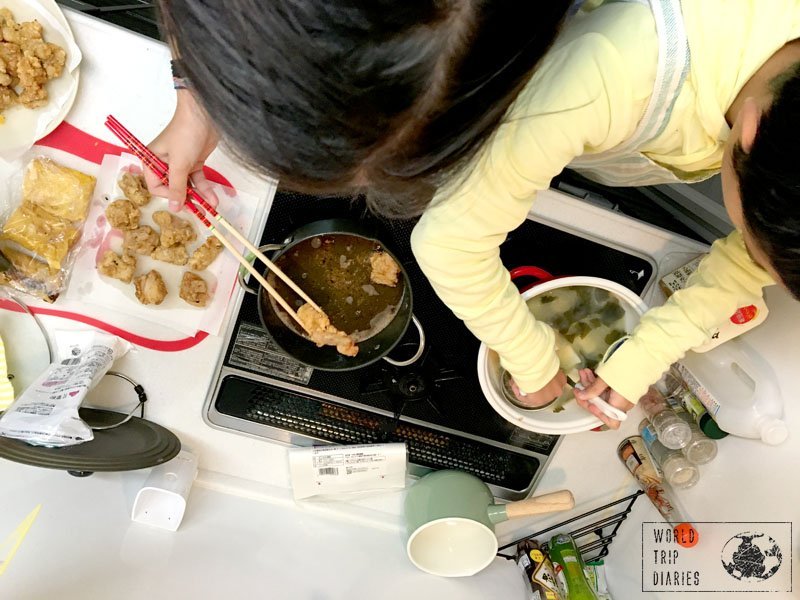
This screenshot has height=600, width=800. In order to click on pots in this screenshot , I will do `click(394, 334)`, `click(608, 288)`.